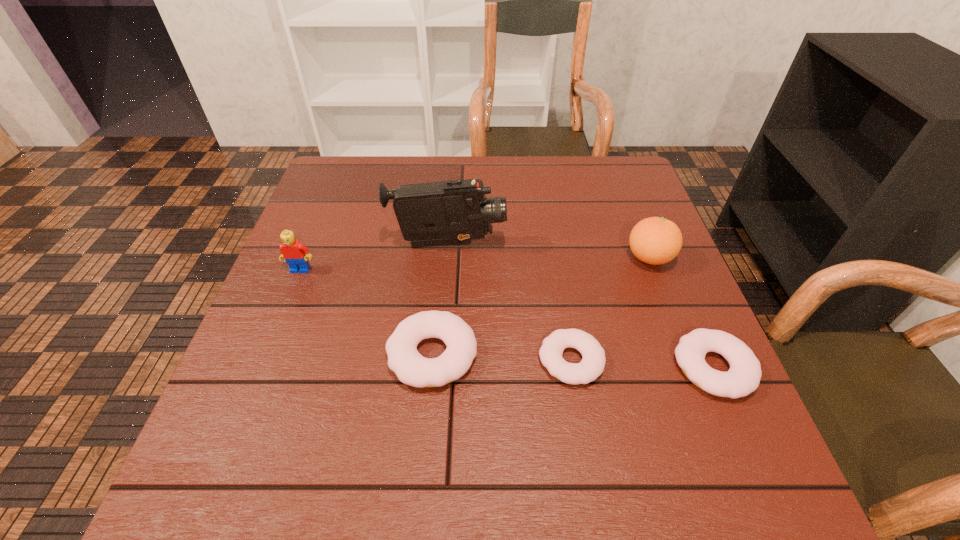
Image resolution: width=960 pixels, height=540 pixels. Identify the location of the leftmost doughnut. (411, 368).

This screenshot has width=960, height=540. Identify the location of the shortest doughnut. (592, 364).

At what (x,y) coordinates should I click in order to perform the action: click on the second doughnut from left to right. Please return your answer as a coordinate pair (x, y). This screenshot has height=540, width=960. Looking at the image, I should click on (592, 364).

At what (x,y) coordinates should I click in order to perform the action: click on the second tallest doughnut. Please return your answer as a coordinate pair (x, y). Looking at the image, I should click on (743, 377).

This screenshot has height=540, width=960. What are the coordinates of `the fifth tallest object` in the screenshot? It's located at (743, 377).

This screenshot has height=540, width=960. In order to click on orange in this screenshot , I will do `click(654, 240)`.

At what (x,y) coordinates should I click in order to perform the action: click on the tallest object. Please return your answer as a coordinate pair (x, y). Looking at the image, I should click on (455, 212).

Locate an element on the screen. The width and height of the screenshot is (960, 540). the leftmost object is located at coordinates (295, 254).

This screenshot has width=960, height=540. Identify the location of free space located on the back of the leftmost doughnut. (443, 238).

I want to click on free space located on the back of the second doughnut from right to left, so click(x=550, y=235).